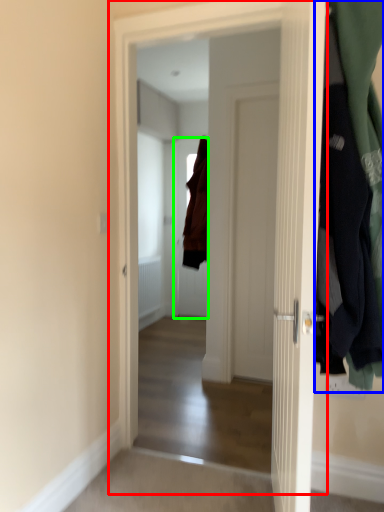
Question: Which object is the closest to the door (highlighted by a red box)? Choose among these: closet (highlighted by a blue box) or door (highlighted by a green box).

Choices:
 (A) closet
 (B) door

Answer: (A)